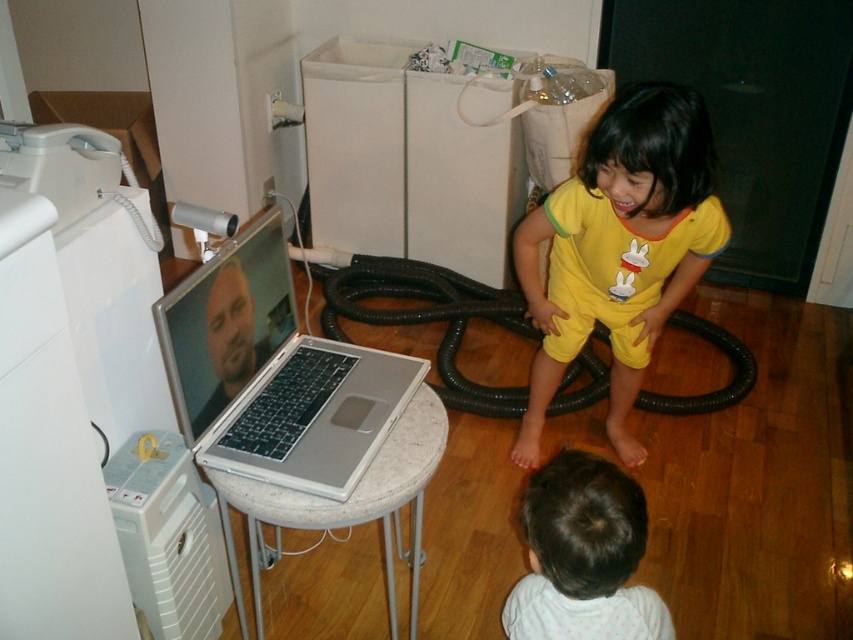
In the scene shown: You are taking a photo of the two points in the image. Which point, point (285,301) or point (572,486), will appear larger in your photo?

Point (285,301) is further to the camera than point (572,486), so it will appear larger in the photo.